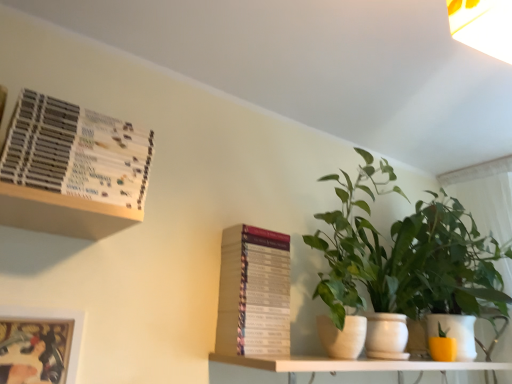
Question: Does point (495, 292) appear closer or farther from the camera than point (224, 273)?

Choices:
 (A) farther
 (B) closer

Answer: (A)

Question: Is green leafy plant at right, the first houseplant from the right, spatially inside hardcover book at center, placed as the 2th paperback book when sorted from front to back, or outside of it?

Choices:
 (A) outside
 (B) inside

Answer: (A)

Question: Which of these objects is positioned closest to the metallic silver picture frame at lower left?

Choices:
 (A) hardcover book at center, placed as the 2th paperback book when sorted from front to back
 (B) green matte plant at center
 (C) green leafy plant at right, which is counted as the 2th houseplant, starting from the right
 (D) white matte shelf at lower center
 (E) yellow matte flowerpot at lower right

Answer: (A)

Question: Estimate the real-world distances between objects in this image. Which object is farther from the metallic silver picture frame at lower left?

Choices:
 (A) green leafy plant at right, which is counted as the 2th houseplant, starting from the right
 (B) green matte plant at center
 (C) white matte shelf at lower center
 (D) green leafy plant at right, which appears as the second houseplant when viewed from the left
 (E) hardcover book at center, placed as the 2th paperback book when sorted from front to back

Answer: (D)